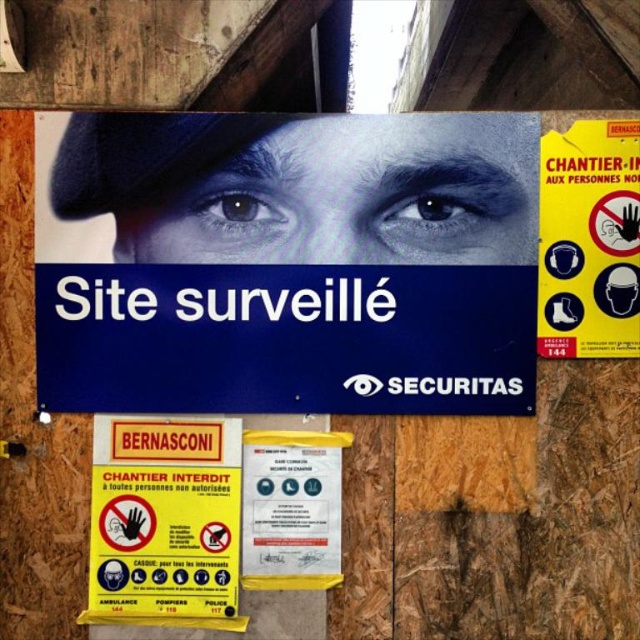
You are a delivery driver who needs to park your truck near the construction site. You see the yellow paper sign at lower left and the yellow paper at center. Which one is taller?

The yellow paper sign at lower left is much taller than the yellow paper at center.

You are a delivery driver who needs to park your truck near the construction site. You see the yellow paper sign at upper right and the yellow paper at center. Which one is wider?

The yellow paper at center is wider than the yellow paper sign at upper right.

You are a delivery driver approaching the construction site and see the yellow paper sign at upper right and the yellow paper sign at lower left. According to the scene description, which yellow paper sign is positioned farther to the right side of the main sign?

The yellow paper sign at upper right is positioned farther to the right side of the main sign because it is to the right of the yellow paper sign at lower left.